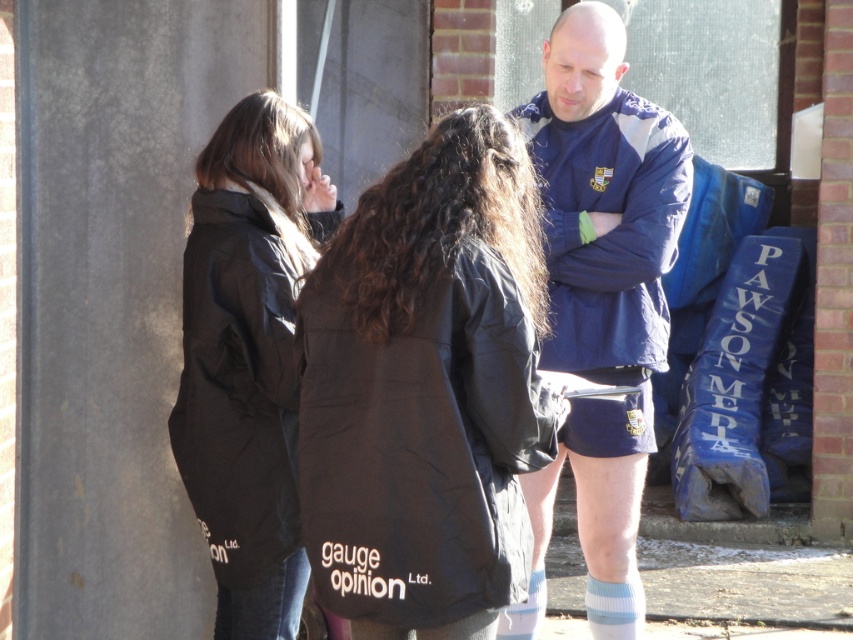
Does matte black jacket at left have a greater height compared to light blue knit sock at lower center?

Indeed, matte black jacket at left has a greater height compared to light blue knit sock at lower center.

Can you confirm if matte black jacket at left is bigger than light blue knit sock at lower center?

Indeed, matte black jacket at left has a larger size compared to light blue knit sock at lower center.

Who is more distant from viewer, (247, 177) or (640, 580)?

The point (640, 580) is more distant.

Where is `matte black jacket at left`? The width and height of the screenshot is (853, 640). matte black jacket at left is located at coordinates (248, 355).

From the picture: Can you confirm if matte black jacket at left is shorter than white knit sock at lower center?

Incorrect, matte black jacket at left's height does not fall short of white knit sock at lower center's.

From the picture: Who is positioned more to the right, matte black jacket at left or white knit sock at lower center?

white knit sock at lower center

Is point (229, 292) farther from viewer compared to point (537, 577)?

No, it is in front of (537, 577).

Find the location of a particular element. matte black jacket at left is located at coordinates (248, 355).

Which is more to the left, blue jersey at center or white knit sock at lower center?

white knit sock at lower center

Is blue jersey at center wider than white knit sock at lower center?

Correct, the width of blue jersey at center exceeds that of white knit sock at lower center.

Image resolution: width=853 pixels, height=640 pixels. I want to click on blue jersey at center, so click(x=602, y=273).